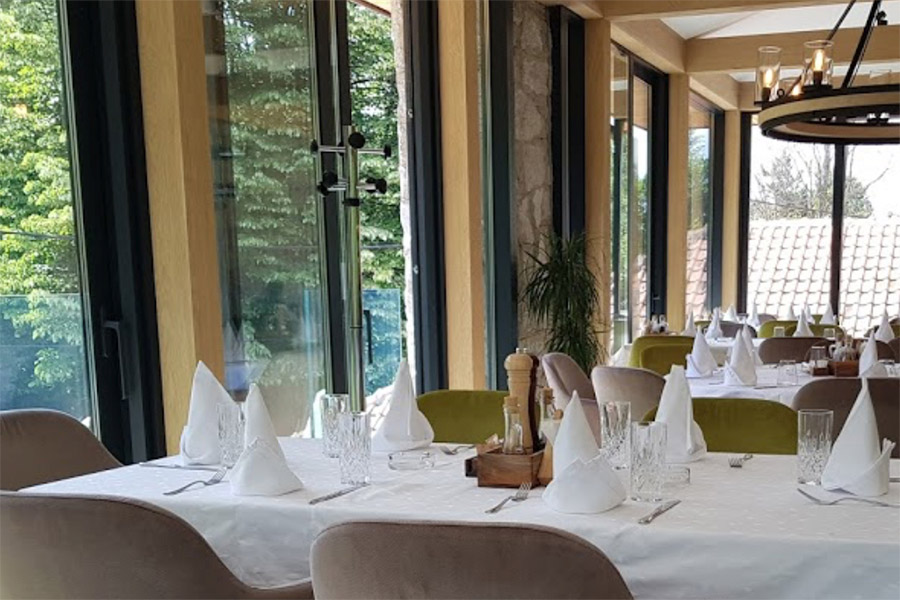
Locate an element on the screen. This screenshot has width=900, height=600. windowpanes or door panels is located at coordinates (32, 284), (272, 253), (376, 262), (626, 236), (699, 230), (784, 235), (858, 234).